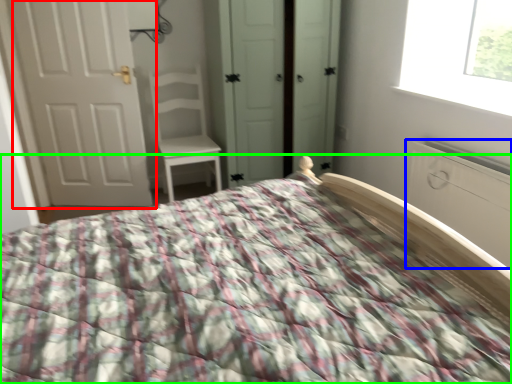
Question: Considering the real-world distances, which object is closest to door (highlighted by a red box)? armoire (highlighted by a blue box) or bed (highlighted by a green box).

Choices:
 (A) armoire
 (B) bed

Answer: (B)